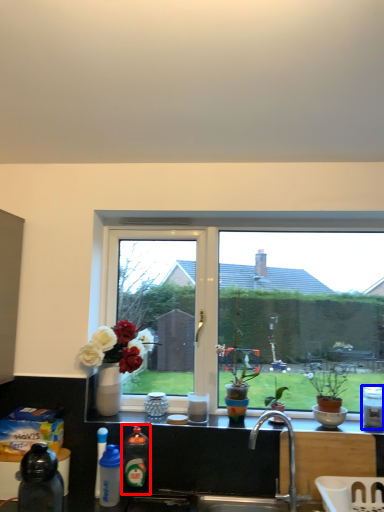
Question: Among these objects, which one is nearest to the camera, bottle (highlighted by a red box) or bottle (highlighted by a blue box)?

Choices:
 (A) bottle
 (B) bottle

Answer: (A)